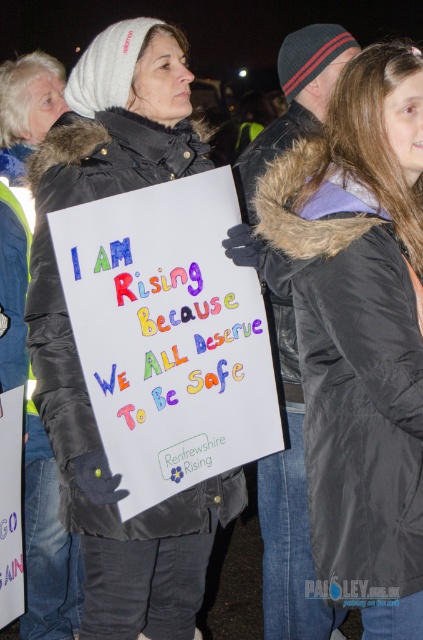
Can you confirm if black fur-lined coat at center is wider than white matte sign at center?

No, black fur-lined coat at center is not wider than white matte sign at center.

Does black fur-lined coat at center appear on the right side of white matte sign at center?

Indeed, black fur-lined coat at center is positioned on the right side of white matte sign at center.

The image size is (423, 640). What do you see at coordinates (356, 342) in the screenshot? I see `black fur-lined coat at center` at bounding box center [356, 342].

Where is `black fur-lined coat at center`? This screenshot has height=640, width=423. black fur-lined coat at center is located at coordinates (356, 342).